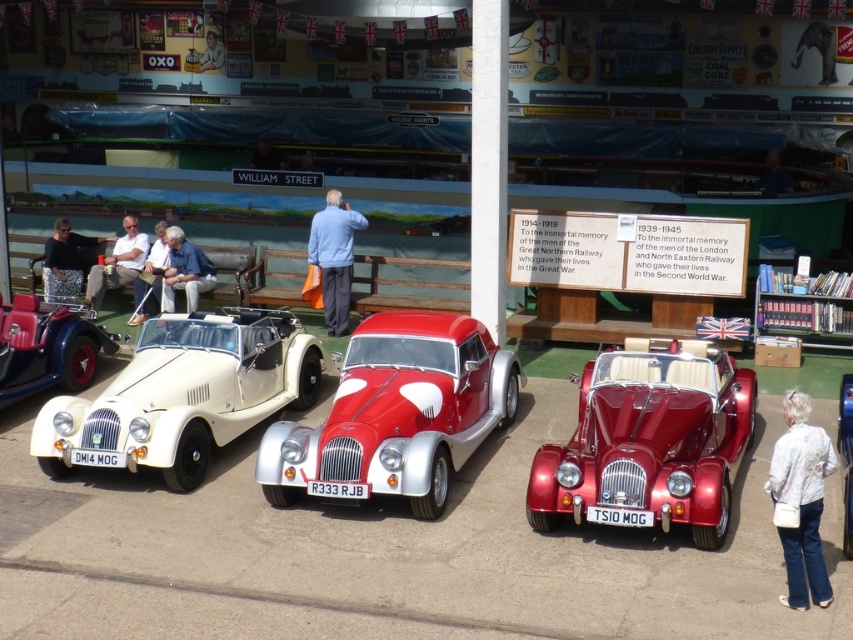
Does shiny red car at center have a larger size compared to white leather jacket at center?

Yes.

Which of these two, shiny red car at center or white leather jacket at center, stands shorter?

white leather jacket at center

Who is more distant from viewer, (613, 384) or (131, 324)?

The point (131, 324) is behind.

What are the coordinates of `shiny red car at center` in the screenshot? It's located at (648, 442).

Consider the image. Who is taller, shiny red car at center or white matte convertible at left?

Standing taller between the two is white matte convertible at left.

Where is `shiny red car at center`? This screenshot has width=853, height=640. shiny red car at center is located at coordinates (648, 442).

Is black floral dress at left further to the viewer compared to white leather jacket at left?

That is True.

Which is more to the left, black floral dress at left or white leather jacket at left?

Positioned to the left is black floral dress at left.

Is point (53, 230) positioned after point (97, 301)?

Yes, it is.

You are a GUI agent. You are given a task and a screenshot of the screen. Output one action in this format:
    pyautogui.click(x=<x>, y=<y>)
    Task: Click on the black floral dress at left
    This screenshot has height=640, width=853.
    Given the screenshot: What is the action you would take?
    pyautogui.click(x=67, y=260)